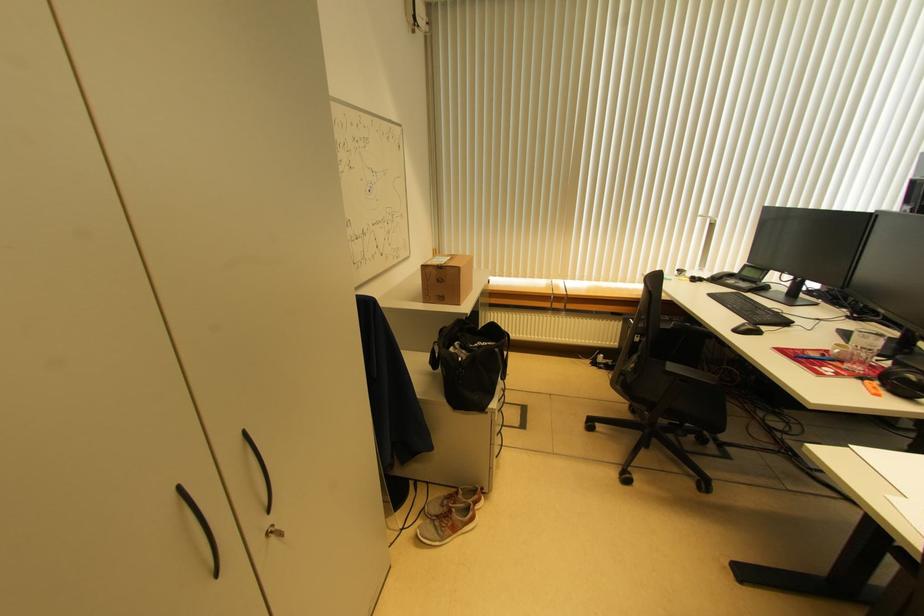
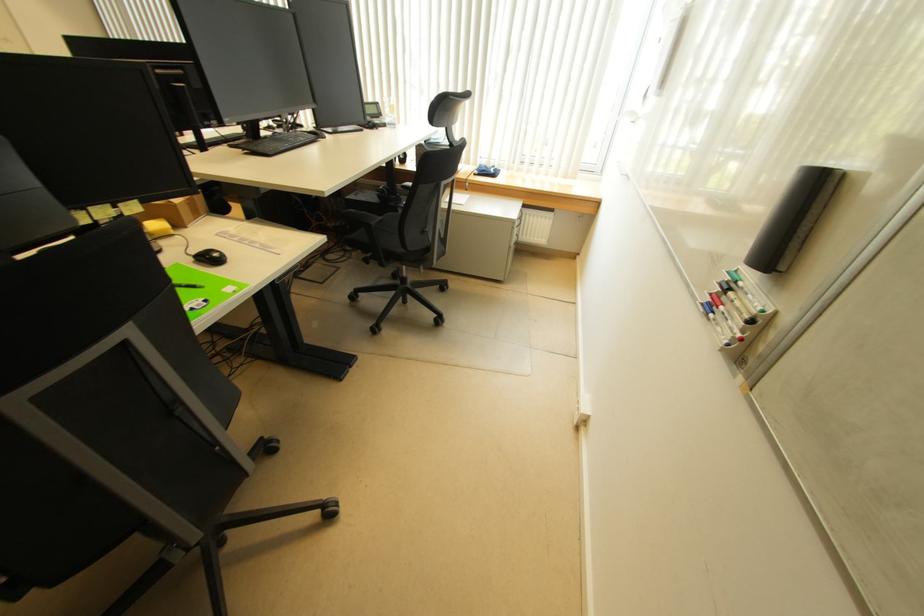
Question: I am providing you with two images of the same scene from different viewpoints. Please identify which objects are invisible in image2.

Choices:
 (A) beige loofah
 (B) chair back handle
 (C) chair armrest
 (D) telephone handset

Answer: (D)